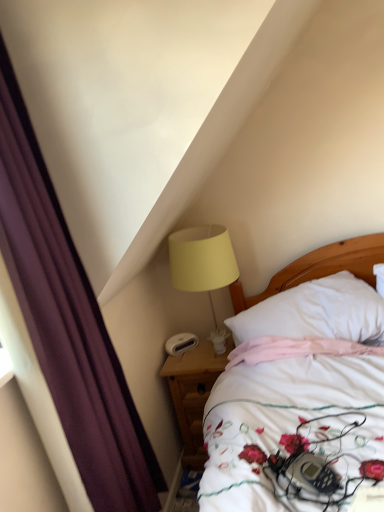
The image size is (384, 512). Identify the location of free point above wooden nightstand at lower center (from a real-world perspective). (195, 351).